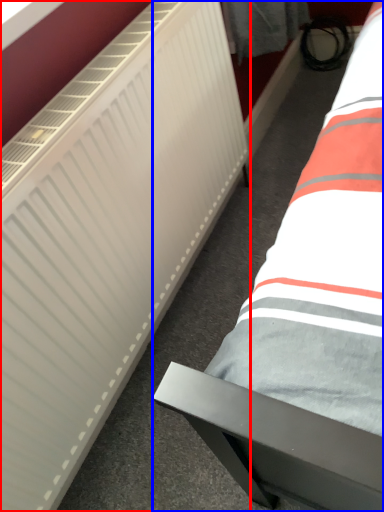
Question: Which object is closer to the camera taking this photo, radiator (highlighted by a red box) or bed (highlighted by a blue box)?

Choices:
 (A) radiator
 (B) bed

Answer: (A)